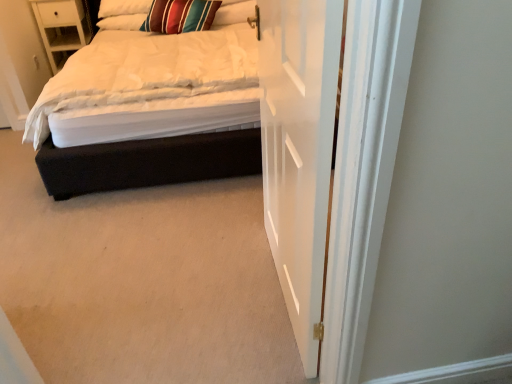
Question: Visually, is white soft pillow at upper left, acting as the second pillow starting from the right, positioned to the left or to the right of white wooden door at center?

Choices:
 (A) left
 (B) right

Answer: (A)

Question: Which is correct: white soft pillow at upper left, acting as the second pillow starting from the right, is inside white wooden door at center, or outside of it?

Choices:
 (A) outside
 (B) inside

Answer: (A)

Question: Based on their relative distances, which object is nearer to the white wood nightstand at upper left?

Choices:
 (A) striped fabric pillow at upper center, which ranks as the 1th pillow in right-to-left order
 (B) velvet black bed at center
 (C) white wooden door at center
 (D) white soft pillow at upper left, acting as the second pillow starting from the right

Answer: (D)

Question: Considering the real-world distances, which object is closest to the white soft pillow at upper left, placed as the 1th pillow when sorted from left to right?

Choices:
 (A) white wood nightstand at upper left
 (B) white wooden door at center
 (C) striped fabric pillow at upper center, the 2th pillow from the left
 (D) velvet black bed at center

Answer: (C)